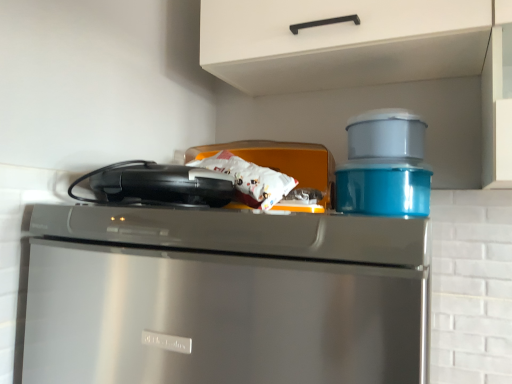
Question: Does matte plastic container at upper right, the second appliance from the right, contain stainless steel dishwasher at upper center?

Choices:
 (A) yes
 (B) no

Answer: (B)

Question: Considering the relative positions of matte plastic container at upper right, placed as the second appliance when sorted from left to right, and stainless steel dishwasher at upper center in the image provided, is matte plastic container at upper right, placed as the second appliance when sorted from left to right, to the left of stainless steel dishwasher at upper center from the viewer's perspective?

Choices:
 (A) no
 (B) yes

Answer: (A)

Question: Is the surface of matte plastic container at upper right, the second appliance from the right, in direct contact with stainless steel dishwasher at upper center?

Choices:
 (A) no
 (B) yes

Answer: (A)

Question: From a real-world perspective, is matte plastic container at upper right, placed as the second appliance when sorted from left to right, beneath stainless steel dishwasher at upper center?

Choices:
 (A) no
 (B) yes

Answer: (A)

Question: Is matte plastic container at upper right, placed as the second appliance when sorted from left to right, to the right of stainless steel dishwasher at upper center from the viewer's perspective?

Choices:
 (A) no
 (B) yes

Answer: (B)

Question: From their relative heights in the image, would you say stainless steel dishwasher at upper center is taller or shorter than white matte cabinet handle at upper center?

Choices:
 (A) tall
 (B) short

Answer: (A)

Question: Based on their positions, is stainless steel dishwasher at upper center located to the left or right of white matte cabinet handle at upper center?

Choices:
 (A) left
 (B) right

Answer: (A)

Question: From a real-world perspective, is stainless steel dishwasher at upper center physically located above or below white matte cabinet handle at upper center?

Choices:
 (A) below
 (B) above

Answer: (A)

Question: Relative to white matte cabinet handle at upper center, is stainless steel dishwasher at upper center in front or behind?

Choices:
 (A) behind
 (B) front

Answer: (B)

Question: Do you think white matte cabinet handle at upper center is within black plastic toaster at upper left, or outside of it?

Choices:
 (A) inside
 (B) outside

Answer: (B)

Question: Considering their positions, is white matte cabinet handle at upper center located in front of or behind black plastic toaster at upper left?

Choices:
 (A) front
 (B) behind

Answer: (B)

Question: From a real-world perspective, is white matte cabinet handle at upper center above or below black plastic toaster at upper left?

Choices:
 (A) above
 (B) below

Answer: (A)

Question: Considering the positions of white matte cabinet handle at upper center and black plastic toaster at upper left in the image, is white matte cabinet handle at upper center wider or thinner than black plastic toaster at upper left?

Choices:
 (A) thin
 (B) wide

Answer: (B)

Question: From the image's perspective, is stainless steel dishwasher at upper center positioned above or below black plastic toaster at upper left?

Choices:
 (A) above
 (B) below

Answer: (B)

Question: Considering the positions of point (56, 365) and point (95, 182), is point (56, 365) closer or farther from the camera than point (95, 182)?

Choices:
 (A) farther
 (B) closer

Answer: (B)